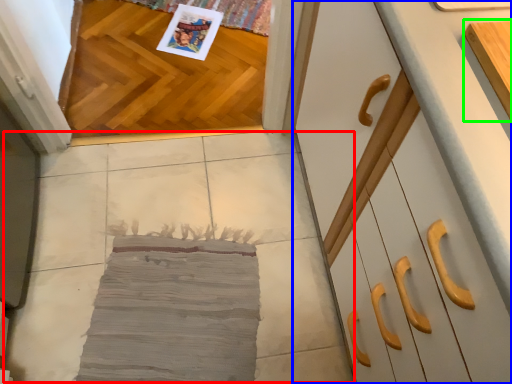
Question: Considering the real-world distances, which object is closest to concrete (highlighted by a red box)? cabinetry (highlighted by a blue box) or cabinetry (highlighted by a green box).

Choices:
 (A) cabinetry
 (B) cabinetry

Answer: (A)